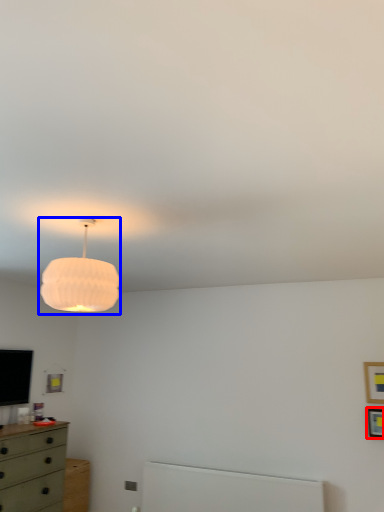
Question: Which point is further to the camera, picture frame (highlighted by a red box) or lamp (highlighted by a blue box)?

Choices:
 (A) picture frame
 (B) lamp

Answer: (A)